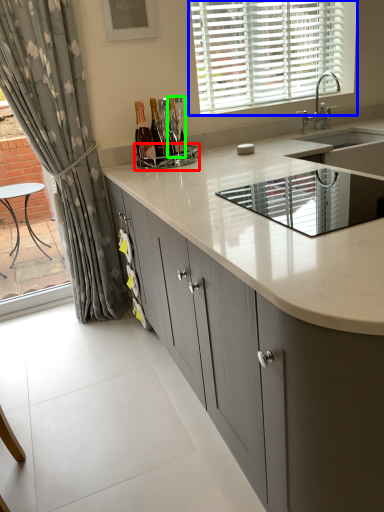
Question: Based on their relative distances, which object is nearer to appliance (highlighted by a red box)? Choose from window (highlighted by a blue box) and bottle (highlighted by a green box).

Choices:
 (A) window
 (B) bottle

Answer: (B)